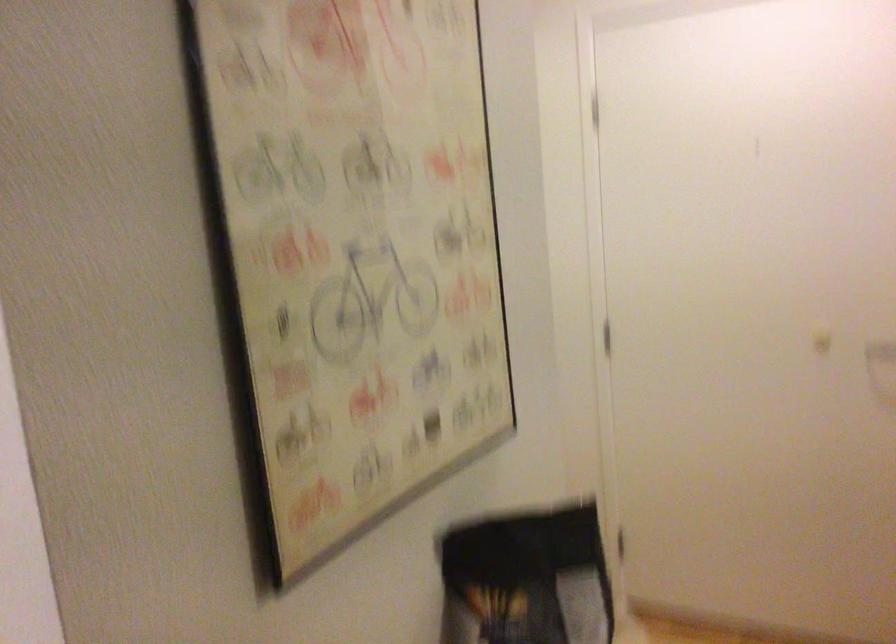
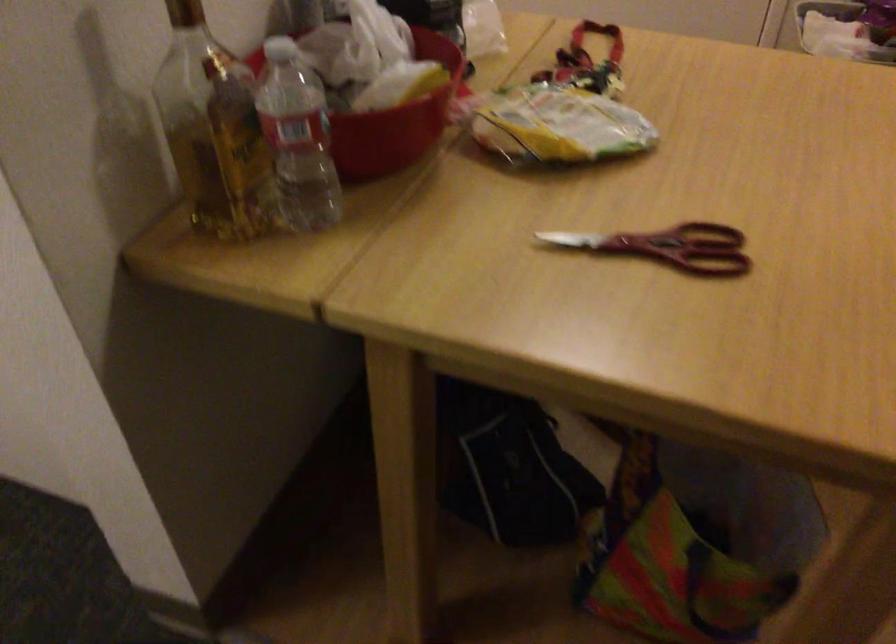
Question: The images are taken continuously from a first-person perspective. In which direction is your viewpoint rotating?

Choices:
 (A) Left
 (B) Right
 (C) Up
 (D) Down

Answer: (D)